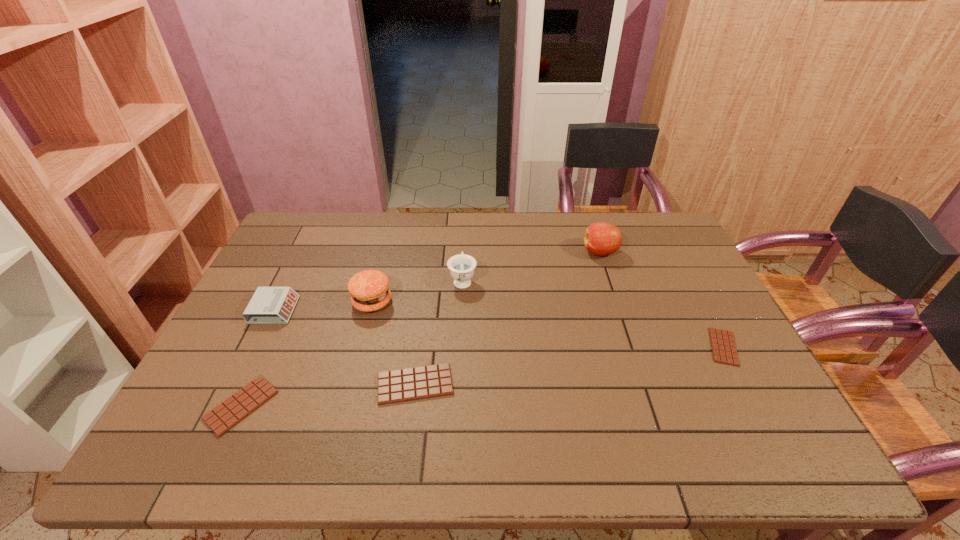
This screenshot has width=960, height=540. What are the coordinates of `object present at the far edge` in the screenshot? It's located at (601, 238).

Locate an element on the screen. candy bar that is at the left edge is located at coordinates (230, 412).

The image size is (960, 540). I want to click on alarm clock at the left edge, so click(x=269, y=305).

Where is `object present at the right edge`? This screenshot has width=960, height=540. object present at the right edge is located at coordinates (724, 351).

Locate an element on the screen. The height and width of the screenshot is (540, 960). object positioned at the near left corner is located at coordinates (230, 412).

You are a GUI agent. You are given a task and a screenshot of the screen. Output one action in this format:
    pyautogui.click(x=<x>, y=<y>)
    Task: Click on the free space at the far edge
    The height and width of the screenshot is (540, 960).
    Given the screenshot: What is the action you would take?
    pyautogui.click(x=498, y=230)

In the image, there is a desktop. Identify the location of vacant area at the near edge. Image resolution: width=960 pixels, height=540 pixels. (578, 400).

In the image, there is a desktop. Where is `free space at the left edge`? Image resolution: width=960 pixels, height=540 pixels. free space at the left edge is located at coordinates (306, 275).

In the image, there is a desktop. What are the coordinates of `vacant area at the right edge` in the screenshot? It's located at [676, 264].

In the image, there is a desktop. Identify the location of vacant space at the far left corner. The height and width of the screenshot is (540, 960). (296, 247).